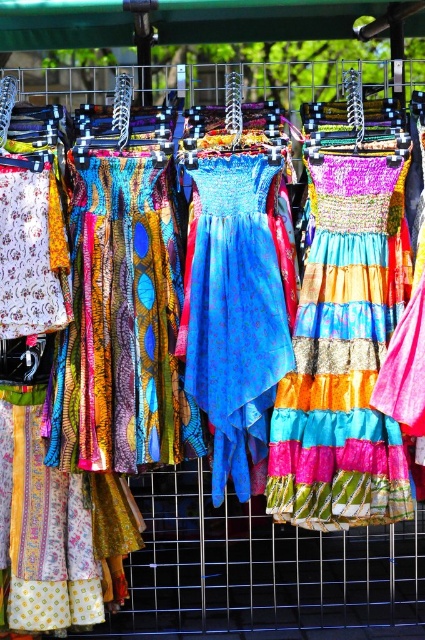
Question: Is shiny multicolored skirt at center positioned before shiny blue fabric dress at center?

Choices:
 (A) no
 (B) yes

Answer: (B)

Question: Which point appears closest to the camera in this image?

Choices:
 (A) (275, 330)
 (B) (357, 404)

Answer: (B)

Question: Which object appears closest to the camera in this image?

Choices:
 (A) shiny blue fabric dress at center
 (B) shiny multicolored skirt at center

Answer: (B)

Question: Which point is closer to the camera?

Choices:
 (A) shiny blue fabric dress at center
 (B) shiny multicolored skirt at center

Answer: (B)

Question: Observing the image, what is the correct spatial positioning of shiny multicolored skirt at center in reference to shiny blue fabric dress at center?

Choices:
 (A) right
 (B) left

Answer: (A)

Question: Is shiny multicolored skirt at center smaller than shiny blue fabric dress at center?

Choices:
 (A) no
 (B) yes

Answer: (A)